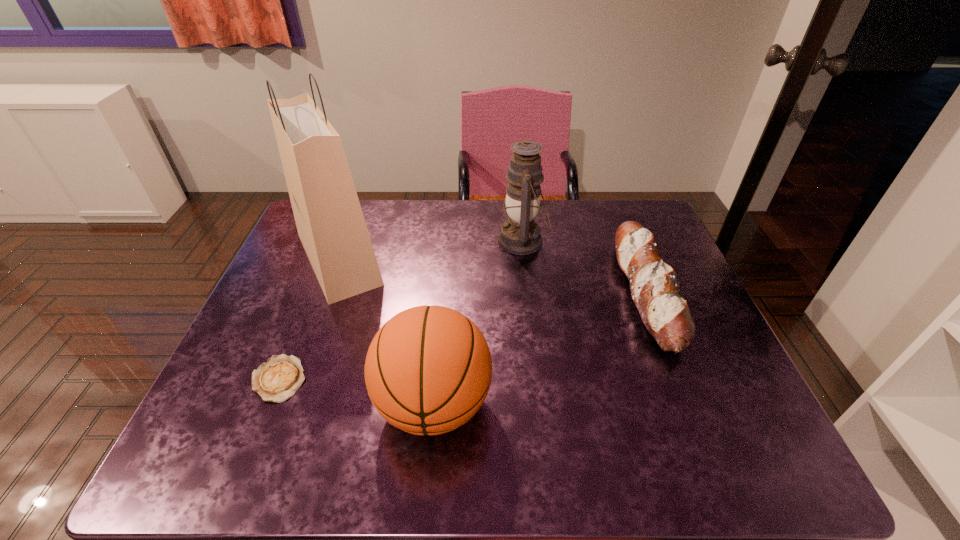
At what (x,y) coordinates should I click in order to perform the action: click on free space between the quiche and the oil lamp. Please return your answer as a coordinate pair (x, y). The height and width of the screenshot is (540, 960). Looking at the image, I should click on (400, 310).

The height and width of the screenshot is (540, 960). Identify the location of vacant point located between the basketball and the quiche. (356, 391).

The image size is (960, 540). I want to click on free point between the third object from right to left and the second object from right to left, so click(x=478, y=322).

Identify which object is located as the nearest to the fourth object from left to right. Please provide its 2D coordinates. Your answer should be formatted as a tuple, i.e. [(x, y)], where the tuple contains the x and y coordinates of a point satisfying the conditions above.

[(654, 289)]

Identify which object is located as the second nearest to the quiche. Please provide its 2D coordinates. Your answer should be formatted as a tuple, i.e. [(x, y)], where the tuple contains the x and y coordinates of a point satisfying the conditions above.

[(330, 223)]

Locate an element on the screen. This screenshot has height=540, width=960. free spot that satisfies the following two spatial constraints: 1. on the back side of the tallest object; 2. on the left side of the shortest object is located at coordinates (327, 259).